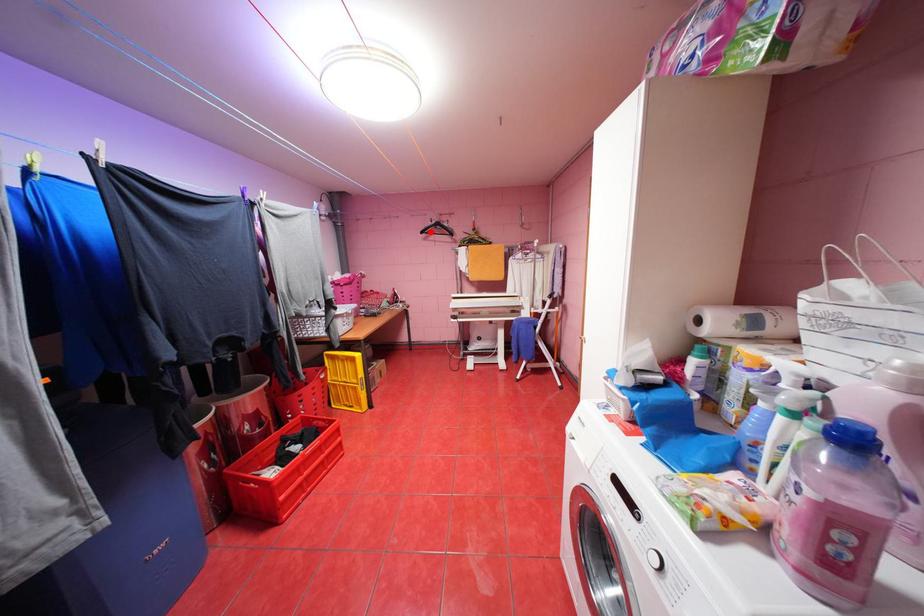
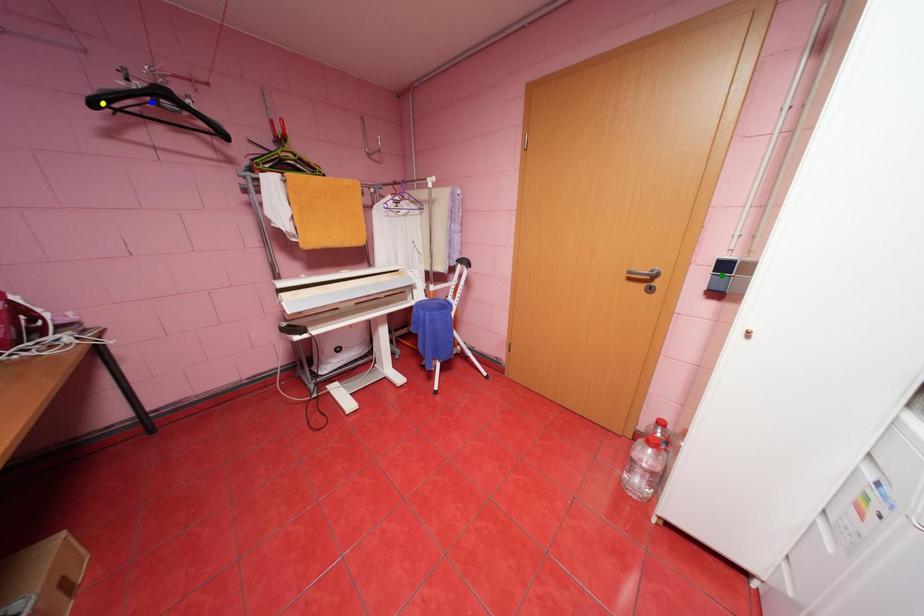
Question: I am providing you with two images of the same scene from different viewpoints. A red point is marked on the first image. You are given multiple points on the second image. Which point in image 2 represents the same 3d spot as the red point in image 1?

Choices:
 (A) blue point
 (B) green point
 (C) yellow point

Answer: (C)